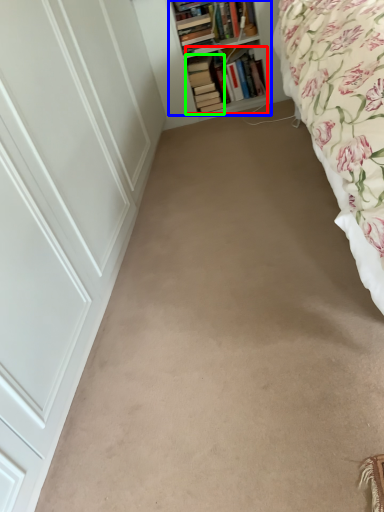
Question: Which object is positioned closest to book (highlighted by a red box)? Select from shelf (highlighted by a blue box) and book (highlighted by a green box).

Choices:
 (A) shelf
 (B) book

Answer: (B)